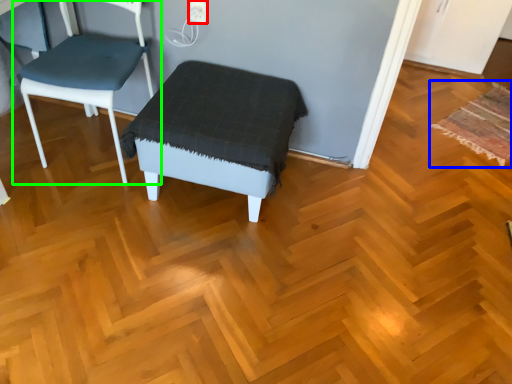
Question: Considering the real-world distances, which object is closest to electric outlet (highlighted by a red box)? mat (highlighted by a blue box) or chair (highlighted by a green box).

Choices:
 (A) mat
 (B) chair

Answer: (B)